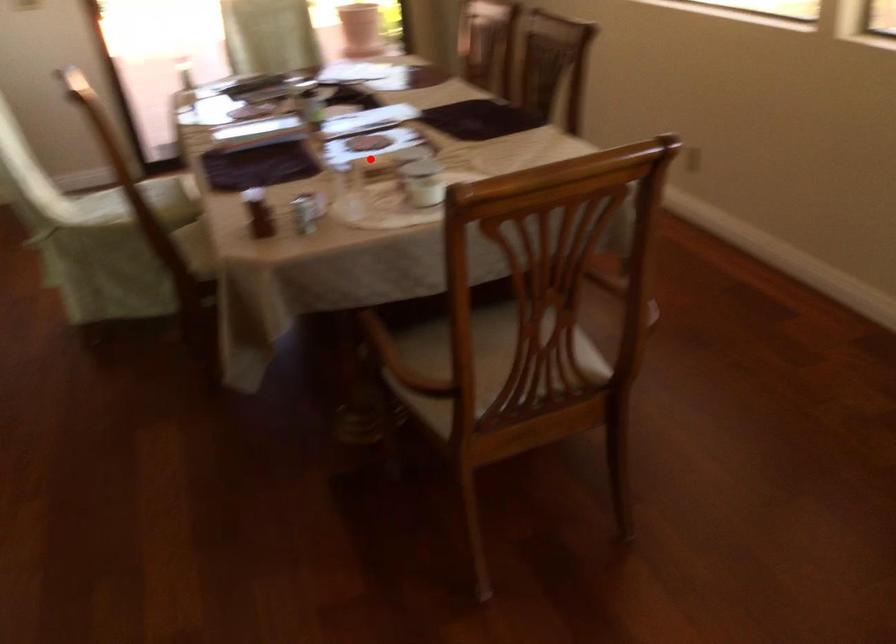
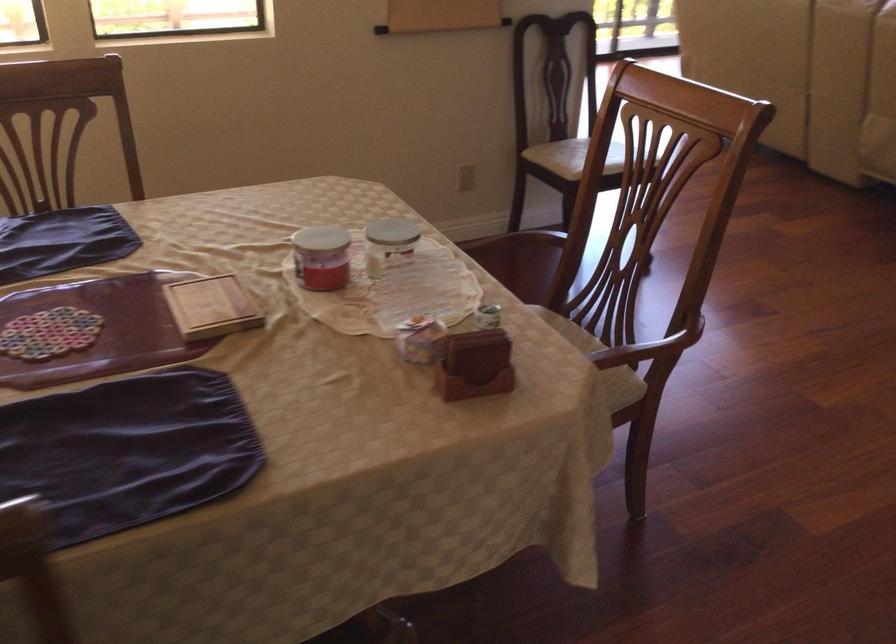
Where in the second image is the point corresponding to the highlighted location from the first image?

(211, 307)